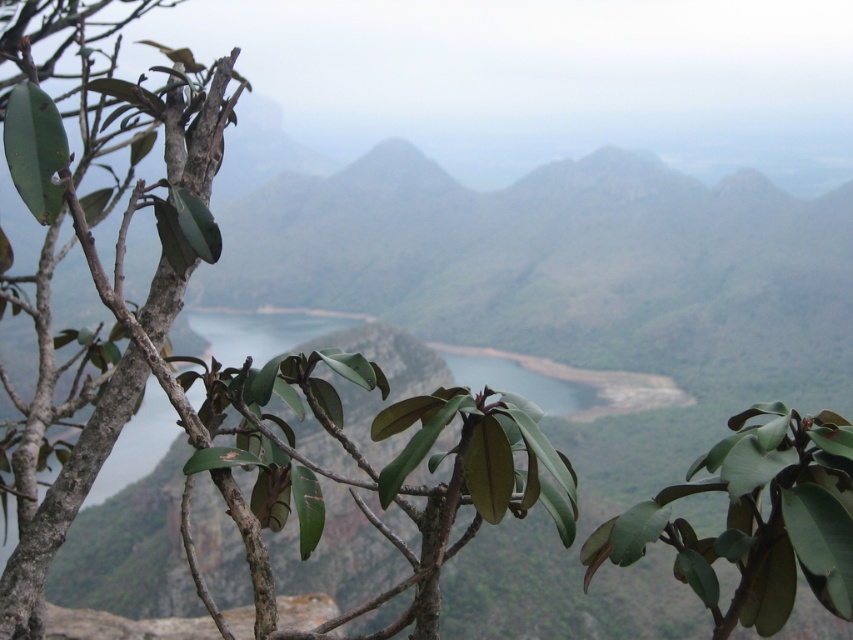
Question: Does green matte leaves at center have a larger size compared to green matte leaf at center?

Choices:
 (A) no
 (B) yes

Answer: (B)

Question: Does green matte leaves at center lie behind green matte leaf at center?

Choices:
 (A) no
 (B) yes

Answer: (A)

Question: Among these points, which one is farthest from the camera?

Choices:
 (A) (112, 106)
 (B) (776, 572)

Answer: (A)

Question: Among these objects, which one is farthest from the camera?

Choices:
 (A) green matte leaf at center
 (B) green matte leaves at center

Answer: (A)

Question: Among these objects, which one is nearest to the camera?

Choices:
 (A) green matte leaves at center
 (B) green matte leaf at center

Answer: (A)

Question: Is green matte leaves at center wider than green matte leaf at center?

Choices:
 (A) yes
 (B) no

Answer: (A)